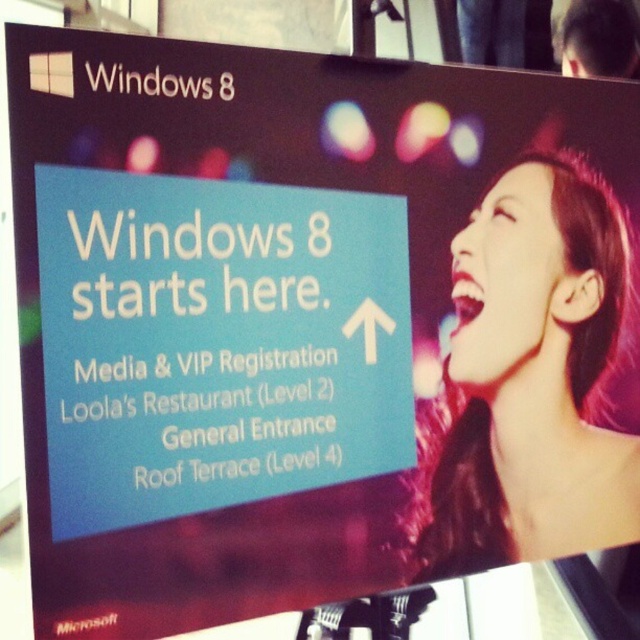
You are attending an event and see the blue paper sign at center and the shiny hair at upper right. Which object is larger in size?

The blue paper sign at center is bigger than the shiny hair at upper right.

You are standing in front of the Windows 8 promotional sign and want to locate the two points marked on it. Which of the two points, point 1 at coordinates (204, 321) or point 2 at (582, 531), is closer to you?

Point 1 at coordinates (204, 321) is closer to you than point 2 at (582, 531).